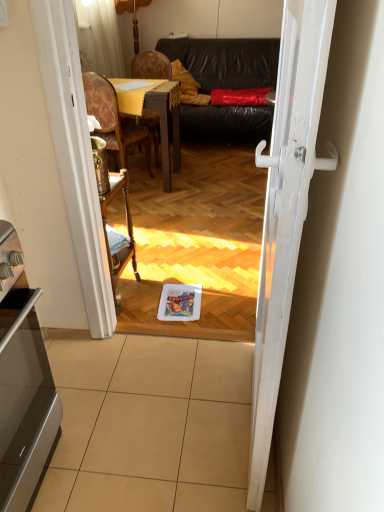
In order to click on unoccupied region to the right of woodenchair at center, placed as the 1th chair when sorted from front to back in this screenshot , I will do `click(177, 187)`.